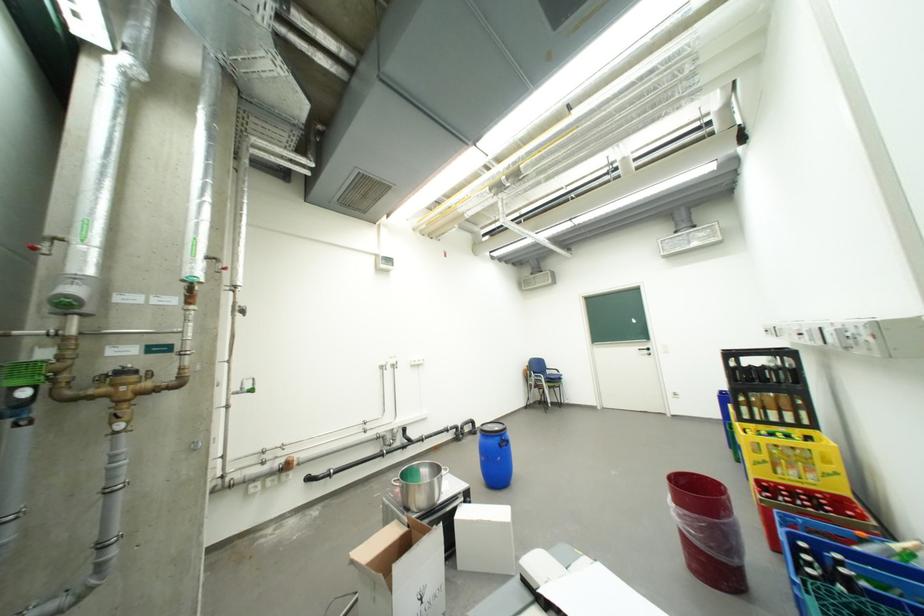
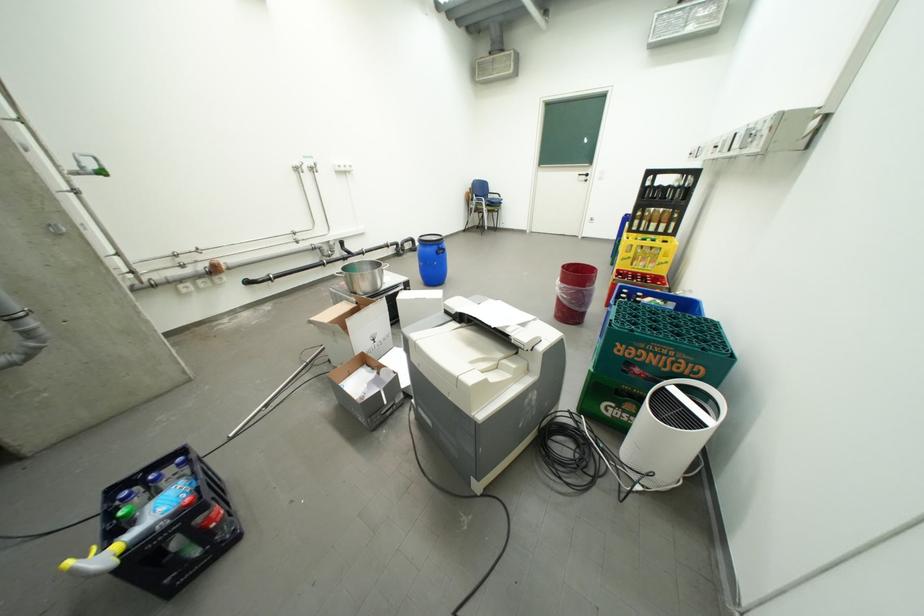
The first image is from the beginning of the video and the second image is from the end. How did the camera likely rotate when shooting the video?

The camera's rotation is toward right-down.